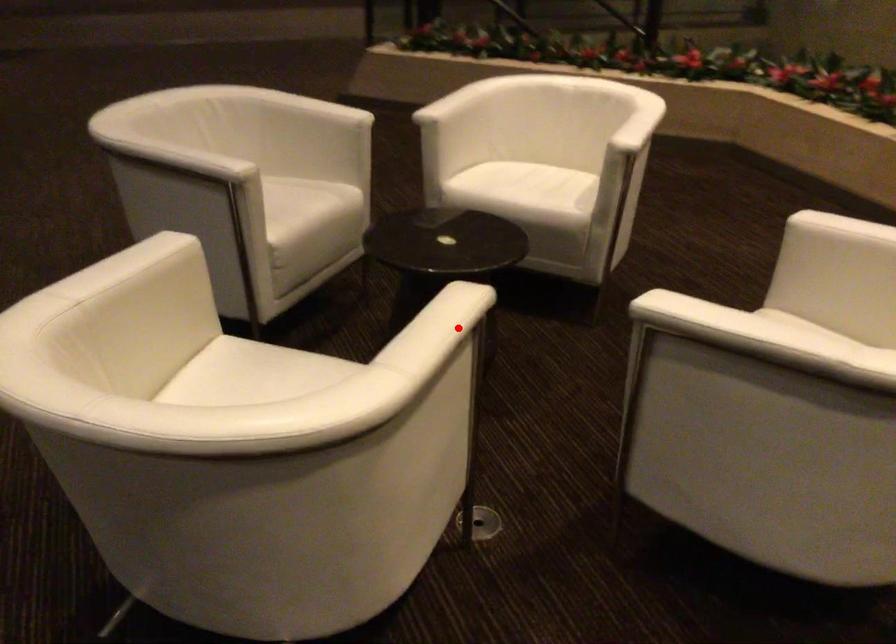
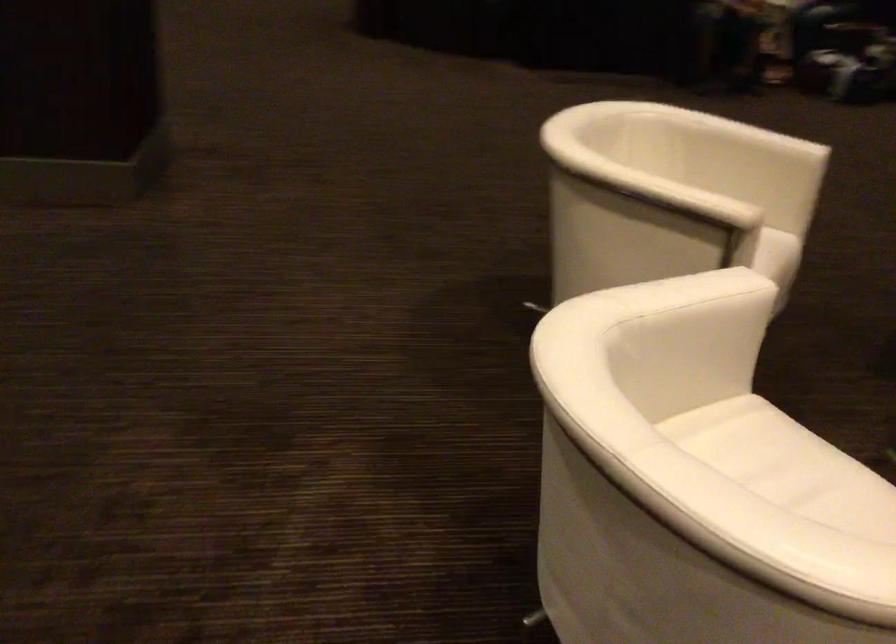
Question: I am providing you with two images of the same scene from different viewpoints. A red point is shown in image1. For the corresponding object point in image2, is it positioned nearer or farther from the camera?

Choices:
 (A) Nearer
 (B) Farther

Answer: (B)